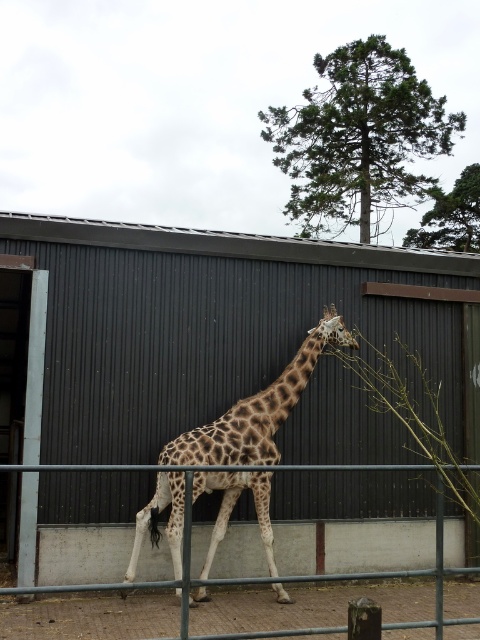
Question: In this image, where is spotted fur giraffe at center located relative to metal/grey fence at lower center?

Choices:
 (A) above
 (B) below

Answer: (A)

Question: Is spotted fur giraffe at center smaller than metal/grey fence at lower center?

Choices:
 (A) yes
 (B) no

Answer: (A)

Question: Which of the following is the closest to the observer?

Choices:
 (A) (171, 451)
 (B) (348, 573)

Answer: (B)

Question: Where is spotted fur giraffe at center located in relation to metal/grey fence at lower center in the image?

Choices:
 (A) right
 (B) left

Answer: (A)